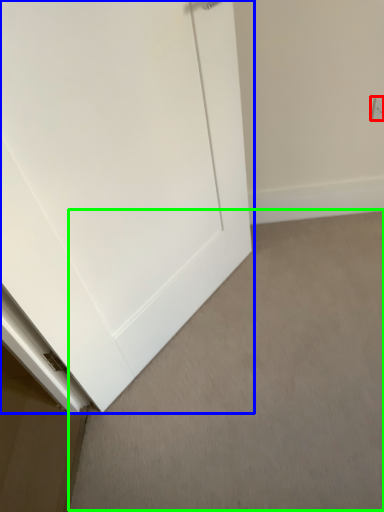
Question: Which object is the farthest from electric outlet (highlighted by a red box)? Choose among these: door (highlighted by a blue box) or plain (highlighted by a green box).

Choices:
 (A) door
 (B) plain

Answer: (B)